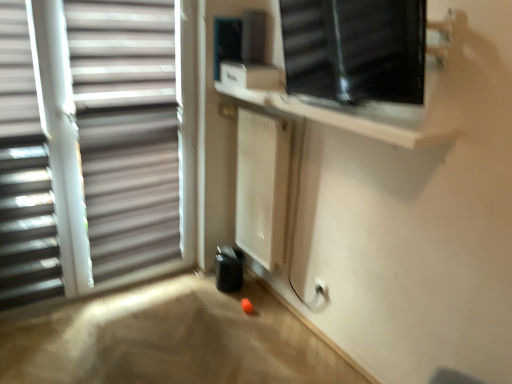
Find the location of a particular element. The height and width of the screenshot is (384, 512). vacant region under transparent glass window at upper right, which is counted as the first window, starting from the right (from a real-world perspective) is located at coordinates (296, 355).